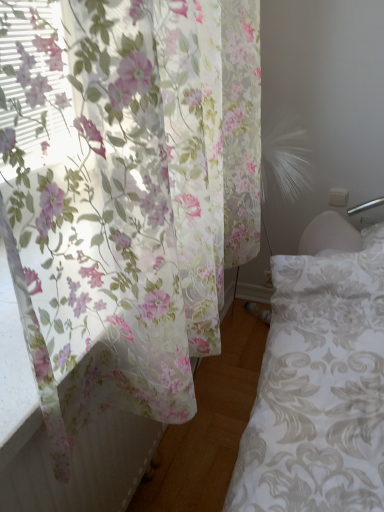
Where is `white damask fabric bed frame at lower right`? This screenshot has width=384, height=512. white damask fabric bed frame at lower right is located at coordinates coord(319,380).

Describe the element at coordinates (319, 380) in the screenshot. The image size is (384, 512). I see `white damask fabric bed frame at lower right` at that location.

What do you see at coordinates (132, 201) in the screenshot? I see `translucent floral curtain at left` at bounding box center [132, 201].

Looking at this image, measure the distance between translucent floral curtain at left and camera.

translucent floral curtain at left and camera are 20.76 inches apart from each other.

Identify the location of translucent floral curtain at left. (132, 201).

In order to face translucent floral curtain at left, should I rotate leftwards or rightwards?

You should look left and rotate roughly 1.721 degrees.

This screenshot has width=384, height=512. In order to click on white damask fabric bed frame at lower right in this screenshot , I will do `click(319, 380)`.

Based on their positions, is translucent floral curtain at left located to the left or right of white damask fabric bed frame at lower right?

Based on their positions, translucent floral curtain at left is located to the left of white damask fabric bed frame at lower right.

Relative to white damask fabric bed frame at lower right, is translucent floral curtain at left in front or behind?

In the image, translucent floral curtain at left appears in front of white damask fabric bed frame at lower right.

Considering the points (255, 249) and (360, 256), which point is behind, point (255, 249) or point (360, 256)?

Point (360, 256)

From the image's perspective, relative to white damask fabric bed frame at lower right, is translucent floral curtain at left above or below?

From the image's perspective, translucent floral curtain at left appears above white damask fabric bed frame at lower right.

From a real-world perspective, is translucent floral curtain at left positioned above or below white damask fabric bed frame at lower right?

translucent floral curtain at left is above white damask fabric bed frame at lower right.

From the picture: Which object is wider, translucent floral curtain at left or white damask fabric bed frame at lower right?

With larger width is white damask fabric bed frame at lower right.

Is translucent floral curtain at left taller or shorter than white damask fabric bed frame at lower right?

Considering their sizes, translucent floral curtain at left has more height than white damask fabric bed frame at lower right.

Looking at this image, between translucent floral curtain at left and white damask fabric bed frame at lower right, which one has smaller size?

With smaller size is white damask fabric bed frame at lower right.

Is white damask fabric bed frame at lower right located within translucent floral curtain at left?

No, white damask fabric bed frame at lower right is not inside translucent floral curtain at left.

Is translucent floral curtain at left with white damask fabric bed frame at lower right?

translucent floral curtain at left is not next to white damask fabric bed frame at lower right, and they're not touching.

Does translucent floral curtain at left turn towards white damask fabric bed frame at lower right?

No, translucent floral curtain at left is not aimed at white damask fabric bed frame at lower right.

Where is `curtain that appears on the left of white damask fabric bed frame at lower right`? The height and width of the screenshot is (512, 384). curtain that appears on the left of white damask fabric bed frame at lower right is located at coordinates (132, 201).

Can you confirm if white damask fabric bed frame at lower right is positioned to the left of translucent floral curtain at left?

In fact, white damask fabric bed frame at lower right is to the right of translucent floral curtain at left.

Which object is further away from the camera taking this photo, white damask fabric bed frame at lower right or translucent floral curtain at left?

white damask fabric bed frame at lower right is further away from the camera.

Is point (360, 470) more distant than point (174, 181)?

Yes.

From the image's perspective, is white damask fabric bed frame at lower right over translucent floral curtain at left?

No, from the image's perspective, white damask fabric bed frame at lower right is not above translucent floral curtain at left.

From a real-world perspective, is white damask fabric bed frame at lower right located higher than translucent floral curtain at left?

Incorrect, from a real-world perspective, white damask fabric bed frame at lower right is lower than translucent floral curtain at left.

Considering the sizes of white damask fabric bed frame at lower right and translucent floral curtain at left in the image, is white damask fabric bed frame at lower right wider or thinner than translucent floral curtain at left?

In the image, white damask fabric bed frame at lower right appears to be wider than translucent floral curtain at left.

Who is taller, white damask fabric bed frame at lower right or translucent floral curtain at left?

translucent floral curtain at left.

Considering the relative sizes of white damask fabric bed frame at lower right and translucent floral curtain at left in the image provided, is white damask fabric bed frame at lower right smaller than translucent floral curtain at left?

Yes, white damask fabric bed frame at lower right is smaller than translucent floral curtain at left.

Is white damask fabric bed frame at lower right located outside translucent floral curtain at left?

Absolutely, white damask fabric bed frame at lower right is external to translucent floral curtain at left.

Is white damask fabric bed frame at lower right directly adjacent to translucent floral curtain at left?

There is a gap between white damask fabric bed frame at lower right and translucent floral curtain at left.

Could you tell me if white damask fabric bed frame at lower right is facing translucent floral curtain at left?

No.

How different are the orientations of white damask fabric bed frame at lower right and translucent floral curtain at left in degrees?

There is a 1.04-degree angle between the facing directions of white damask fabric bed frame at lower right and translucent floral curtain at left.

The width and height of the screenshot is (384, 512). In order to click on bed frame that is below the translucent floral curtain at left (from the image's perspective) in this screenshot , I will do (319, 380).

Locate an element on the screen. This screenshot has width=384, height=512. bed frame on the right of translucent floral curtain at left is located at coordinates (319, 380).

Find the location of `bed frame below the translucent floral curtain at left (from the image's perspective)`. bed frame below the translucent floral curtain at left (from the image's perspective) is located at coordinates (319, 380).